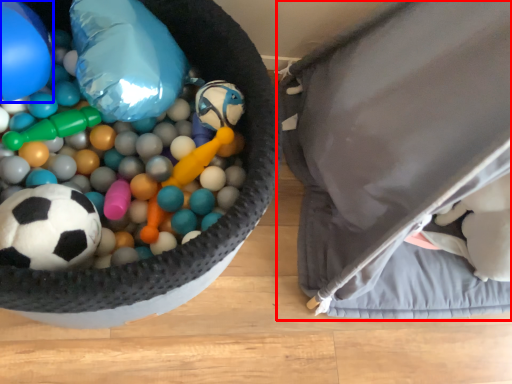
Question: Which object appears farthest to the camera in this image, bean bag chair (highlighted by a red box) or balloon (highlighted by a blue box)?

Choices:
 (A) bean bag chair
 (B) balloon

Answer: (B)